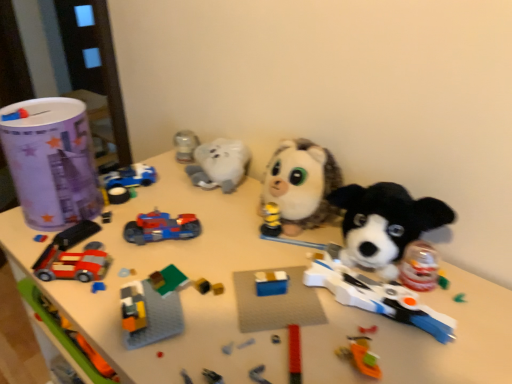
Identify the location of free spot to the left of shiny plastic toy car at center, which is counted as the second toy, starting from the right. The image size is (512, 384). (87, 234).